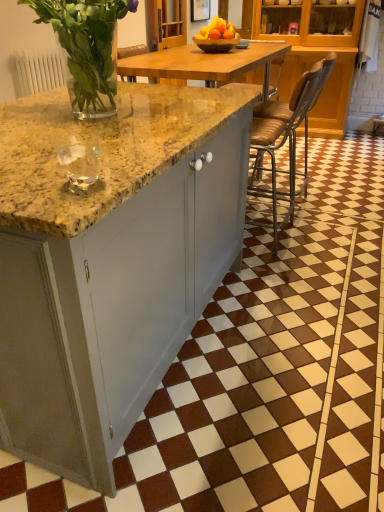
Question: From a real-world perspective, is clear glass vase at upper left physically located above or below matte gray cabinet at center?

Choices:
 (A) above
 (B) below

Answer: (A)

Question: Is point (99, 31) closer or farther from the camera than point (33, 402)?

Choices:
 (A) farther
 (B) closer

Answer: (A)

Question: Which object is the farthest from the clear glass vase at upper left?

Choices:
 (A) clear glass at left
 (B) matte gray cabinet at center
 (C) metallic brown bar stool at center
 (D) wooden bowl at center

Answer: (C)

Question: Which object is positioned closest to the wooden bowl at center?

Choices:
 (A) metallic brown bar stool at center
 (B) clear glass vase at upper left
 (C) clear glass at left
 (D) matte gray cabinet at center

Answer: (A)